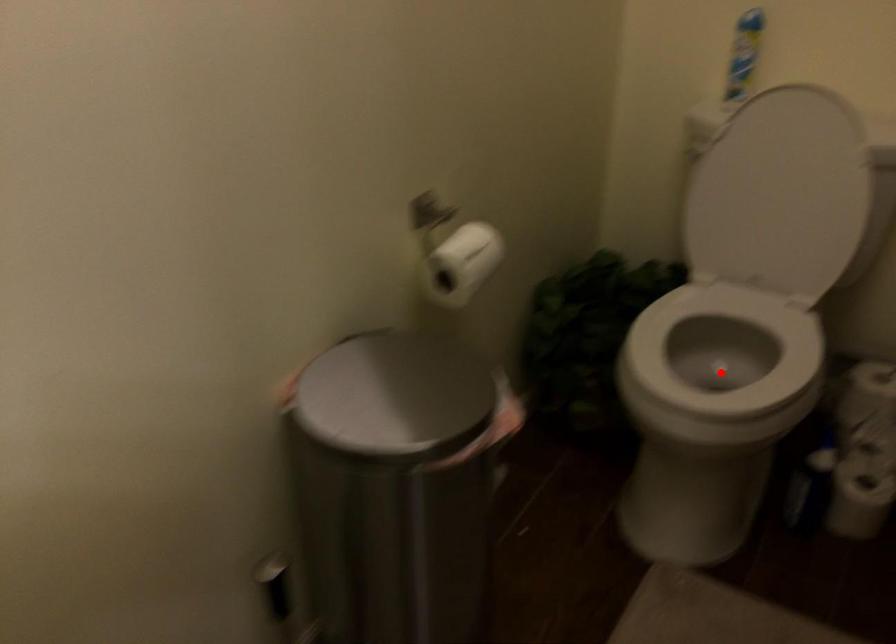
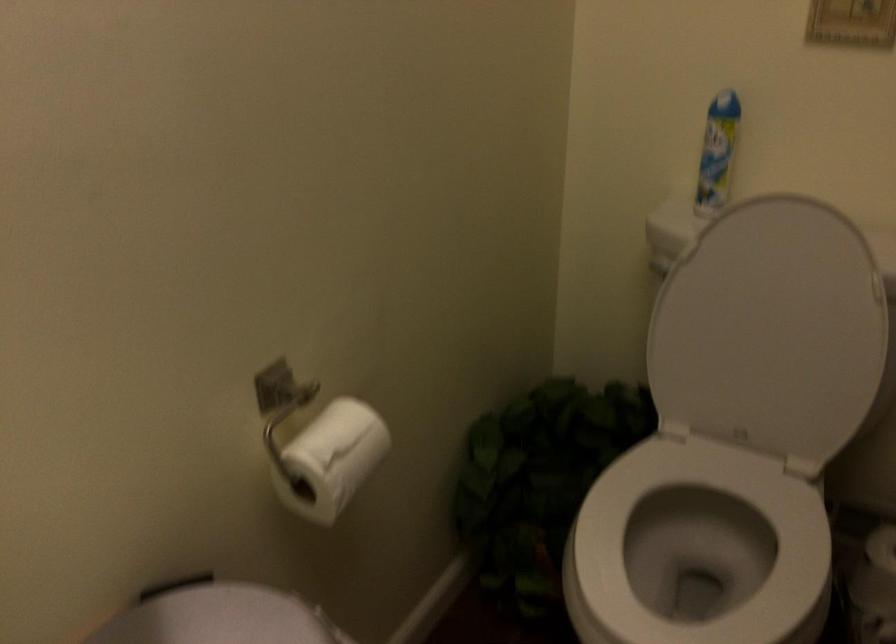
The point at the highlighted location is marked in the first image. Where is the corresponding point in the second image?

(698, 547)